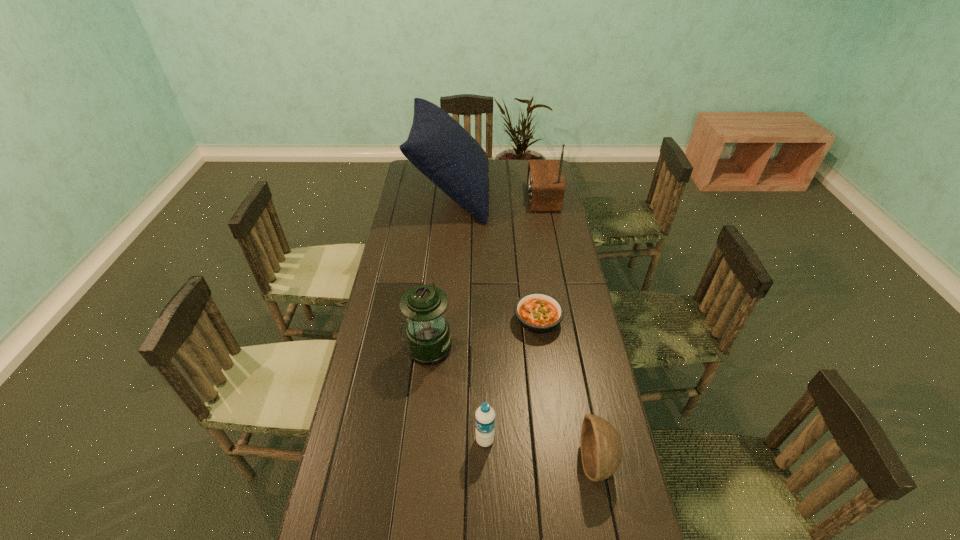
In order to click on cushion in this screenshot , I will do `click(438, 146)`.

I want to click on radio receiver, so click(x=545, y=183).

Image resolution: width=960 pixels, height=540 pixels. In order to click on the fourth shortest object in this screenshot , I will do `click(428, 342)`.

Find the location of a particular element. water bottle is located at coordinates (485, 415).

You are a GUI agent. You are given a task and a screenshot of the screen. Output one action in this format:
    pyautogui.click(x=<x>, y=<y>)
    Task: Click on the bowl
    Image resolution: width=960 pixels, height=540 pixels.
    Given the screenshot: What is the action you would take?
    pyautogui.click(x=601, y=448)

This screenshot has width=960, height=540. In order to click on the shortest object in this screenshot , I will do `click(539, 313)`.

The height and width of the screenshot is (540, 960). In order to click on vacant space located on the facing side of the cushion in this screenshot , I will do point(553,193).

This screenshot has width=960, height=540. Find the location of `vacant point located on the front-facing side of the second tallest object`. vacant point located on the front-facing side of the second tallest object is located at coordinates (x=489, y=198).

You are a GUI agent. You are given a task and a screenshot of the screen. Output one action in this format:
    pyautogui.click(x=<x>, y=<y>)
    Task: Click on the free space located on the front-facing side of the second tallest object
    
    Given the screenshot: What is the action you would take?
    pyautogui.click(x=510, y=198)

You are a GUI agent. You are given a task and a screenshot of the screen. Output one action in this format:
    pyautogui.click(x=<x>, y=<y>)
    Task: Click on the free space located on the front-facing side of the second tallest object
    This screenshot has width=960, height=540.
    Given the screenshot: What is the action you would take?
    pyautogui.click(x=482, y=198)